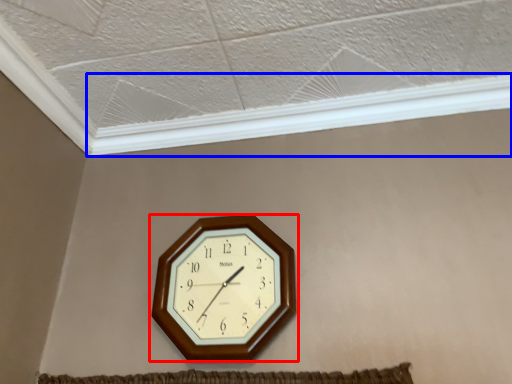
Question: Among these objects, which one is farthest to the camera, wall clock (highlighted by a red box) or window frame (highlighted by a blue box)?

Choices:
 (A) wall clock
 (B) window frame

Answer: (B)